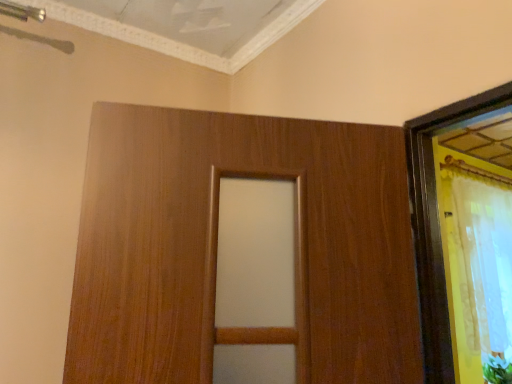
Describe the element at coordinates (484, 263) in the screenshot. I see `white sheer curtain at right` at that location.

The width and height of the screenshot is (512, 384). Find the location of `white sheer curtain at right`. white sheer curtain at right is located at coordinates (484, 263).

This screenshot has width=512, height=384. What do you see at coordinates (497, 369) in the screenshot? I see `green leafy plant at lower right` at bounding box center [497, 369].

Where is `green leafy plant at lower right`? The height and width of the screenshot is (384, 512). green leafy plant at lower right is located at coordinates (497, 369).

The image size is (512, 384). I want to click on white sheer curtain at right, so click(x=484, y=263).

Is green leafy plant at lower right at the right side of white sheer curtain at right?

Correct, you'll find green leafy plant at lower right to the right of white sheer curtain at right.

Relative to white sheer curtain at right, is green leafy plant at lower right in front or behind?

Visually, green leafy plant at lower right is located behind white sheer curtain at right.

Between point (506, 367) and point (508, 253), which one is positioned behind?

The point (508, 253) is farther.

Looking at this image, from the image's perspective, is green leafy plant at lower right above or below white sheer curtain at right?

green leafy plant at lower right is situated lower than white sheer curtain at right in the image.

From a real-world perspective, which is physically above, green leafy plant at lower right or white sheer curtain at right?

white sheer curtain at right.

Considering the relative sizes of green leafy plant at lower right and white sheer curtain at right in the image provided, is green leafy plant at lower right wider than white sheer curtain at right?

Indeed, green leafy plant at lower right has a greater width compared to white sheer curtain at right.

Can you confirm if green leafy plant at lower right is shorter than white sheer curtain at right?

Yes.

Between green leafy plant at lower right and white sheer curtain at right, which one has smaller size?

Smaller between the two is green leafy plant at lower right.

Is green leafy plant at lower right inside the boundaries of white sheer curtain at right, or outside?

green leafy plant at lower right is outside white sheer curtain at right.

Are green leafy plant at lower right and white sheer curtain at right located far from each other?

No, green leafy plant at lower right is in close proximity to white sheer curtain at right.

Is green leafy plant at lower right oriented towards white sheer curtain at right?

No, green leafy plant at lower right does not turn towards white sheer curtain at right.

How many degrees apart are the facing directions of green leafy plant at lower right and white sheer curtain at right?

The angular difference between green leafy plant at lower right and white sheer curtain at right is 4.74 degrees.

Identify the location of curtain that is in front of the green leafy plant at lower right. (484, 263).

Based on the photo, considering the relative positions of white sheer curtain at right and green leafy plant at lower right in the image provided, is white sheer curtain at right to the left or to the right of green leafy plant at lower right?

In the image, white sheer curtain at right appears on the left side of green leafy plant at lower right.

Is white sheer curtain at right further to the viewer compared to green leafy plant at lower right?

No, it is not.

Does point (494, 286) lie in front of point (502, 365)?

No, it is behind (502, 365).

From the image's perspective, is white sheer curtain at right on top of green leafy plant at lower right?

Yes, from the image's perspective, white sheer curtain at right is over green leafy plant at lower right.

From a real-world perspective, which object rests below the other?

In real-world perspective, green leafy plant at lower right is lower.

Is white sheer curtain at right thinner than green leafy plant at lower right?

Indeed, white sheer curtain at right has a lesser width compared to green leafy plant at lower right.

Who is taller, white sheer curtain at right or green leafy plant at lower right?

With more height is white sheer curtain at right.

Which of these two, white sheer curtain at right or green leafy plant at lower right, is smaller?

green leafy plant at lower right.

Do you think white sheer curtain at right is within green leafy plant at lower right, or outside of it?

white sheer curtain at right lies outside green leafy plant at lower right.

Is white sheer curtain at right beside green leafy plant at lower right?

No, white sheer curtain at right is not touching green leafy plant at lower right.

Could you tell me if white sheer curtain at right is facing green leafy plant at lower right?

No.

This screenshot has width=512, height=384. I want to click on plant behind the white sheer curtain at right, so click(x=497, y=369).

In order to click on curtain above the green leafy plant at lower right (from a real-world perspective) in this screenshot , I will do `click(484, 263)`.

The width and height of the screenshot is (512, 384). In order to click on curtain in front of the green leafy plant at lower right in this screenshot , I will do `click(484, 263)`.